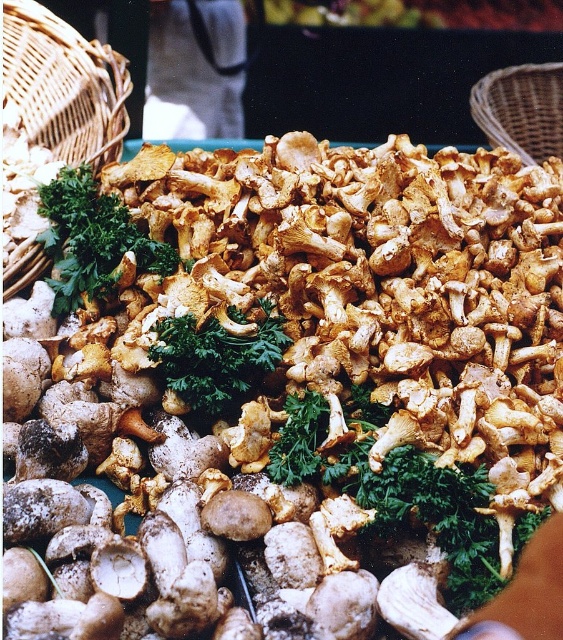
Question: Observing the image, what is the correct spatial positioning of woven brown basket at upper left in reference to green leafy at center?

Choices:
 (A) right
 (B) left

Answer: (B)

Question: In this image, where is green leafy at center located relative to woven brown basket at upper right?

Choices:
 (A) above
 (B) below

Answer: (B)

Question: Considering the real-world distances, which object is closest to the woven brown basket at upper left?

Choices:
 (A) woven brown basket at upper right
 (B) green leafy at center

Answer: (B)

Question: Which of the following is the farthest from the observer?

Choices:
 (A) (194, 404)
 (B) (57, 19)
 (C) (538, 80)

Answer: (C)

Question: Is the position of green leafy at center more distant than that of woven brown basket at upper right?

Choices:
 (A) yes
 (B) no

Answer: (B)

Question: Among these objects, which one is nearest to the camera?

Choices:
 (A) woven brown basket at upper right
 (B) woven brown basket at upper left

Answer: (B)